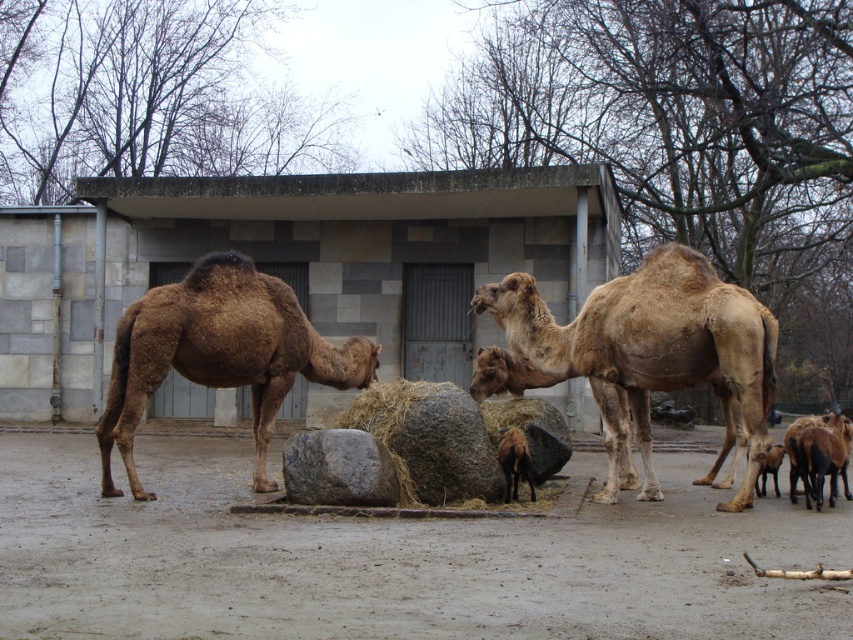
Question: Which object is closer to the camera taking this photo?

Choices:
 (A) gray rough rock at center
 (B) dull gray dirt at center

Answer: (B)

Question: Does desert tan camel at center have a greater width compared to gray rough rock at center?

Choices:
 (A) yes
 (B) no

Answer: (B)

Question: Considering the real-world distances, which object is farthest from the brown matte camel at left?

Choices:
 (A) brown fuzzy goat at lower right
 (B) desert tan camel at center
 (C) dull gray dirt at center

Answer: (A)

Question: Observing the image, what is the correct spatial positioning of desert tan camel at center in reference to brown matte camel at left?

Choices:
 (A) left
 (B) right

Answer: (B)

Question: Which point is closer to the camera?

Choices:
 (A) (120, 429)
 (B) (643, 476)

Answer: (A)

Question: Does gray rough rock at center appear on the right side of brown fuzzy goat at center?

Choices:
 (A) no
 (B) yes

Answer: (A)